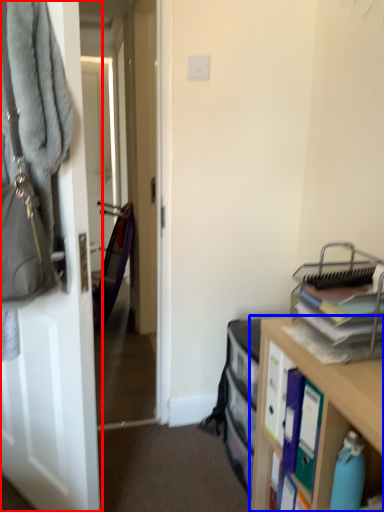
Question: Which of the following is the closest to the observer, door (highlighted by a red box) or cabinetry (highlighted by a blue box)?

Choices:
 (A) door
 (B) cabinetry

Answer: (B)